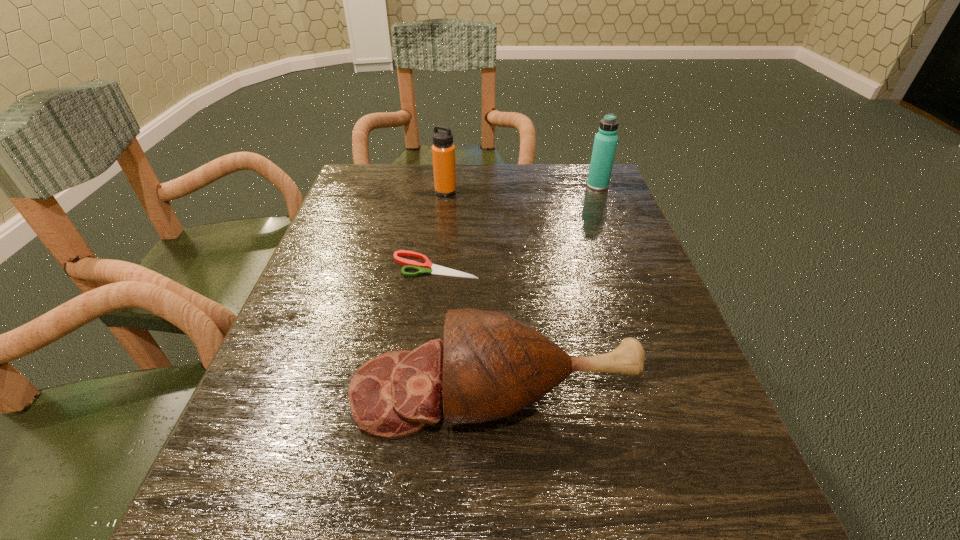
What are the coordinates of `free space between the left thermos bottle and the third farthest object` in the screenshot? It's located at (441, 228).

Find the location of a particular element. free area in between the left thermos bottle and the rightmost object is located at coordinates (521, 188).

The height and width of the screenshot is (540, 960). I want to click on vacant area between the shortest object and the left thermos bottle, so click(x=441, y=228).

Identify the location of empty space that is in between the ham and the right thermos bottle. The height and width of the screenshot is (540, 960). tap(544, 288).

What are the coordinates of `vacant area that lies between the third tallest object and the left thermos bottle` in the screenshot? It's located at (468, 292).

At what (x,y) coordinates should I click in order to perform the action: click on free spot between the right thermos bottle and the left thermos bottle. Please return your answer as a coordinate pair (x, y). This screenshot has width=960, height=540. Looking at the image, I should click on (521, 188).

Identify the location of free point between the second shortest object and the left thermos bottle. The height and width of the screenshot is (540, 960). (468, 292).

Find the location of a particular element. The image size is (960, 540). object that stands as the second closest to the second shortest object is located at coordinates (443, 150).

Identify which object is the third closest to the left thermos bottle. Please provide its 2D coordinates. Your answer should be formatted as a tuple, i.e. [(x, y)], where the tuple contains the x and y coordinates of a point satisfying the conditions above.

[(490, 366)]

Where is `free space that satisfies the following two spatial constraints: 1. on the back side of the left thermos bottle; 2. on the right side of the third farthest object`? This screenshot has width=960, height=540. free space that satisfies the following two spatial constraints: 1. on the back side of the left thermos bottle; 2. on the right side of the third farthest object is located at coordinates (444, 192).